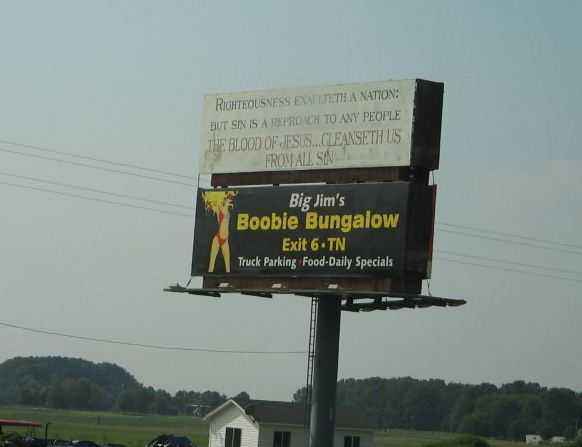
The height and width of the screenshot is (447, 582). I want to click on window, so click(x=281, y=436).